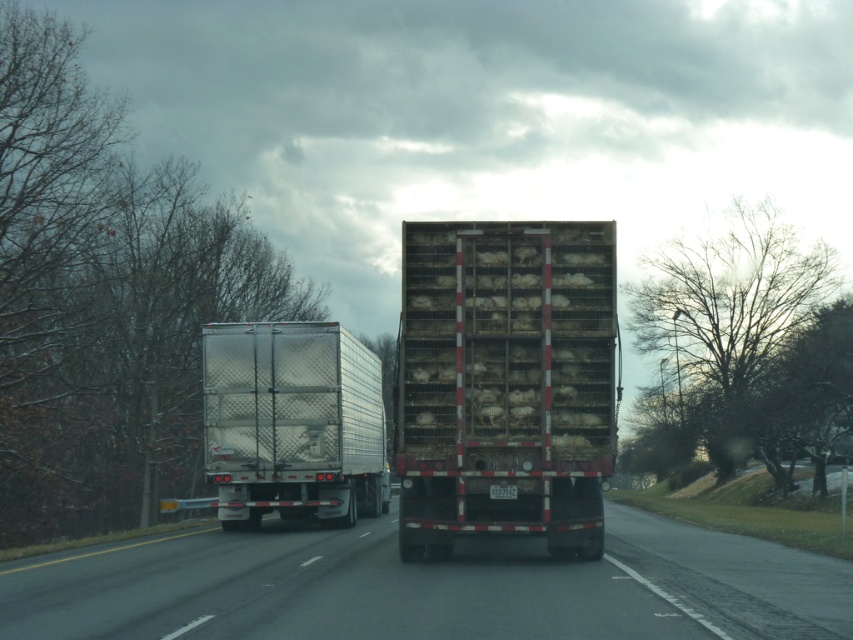
Question: Is the position of black rubber highway at center more distant than that of silver metallic trailer truck at center?

Choices:
 (A) yes
 (B) no

Answer: (B)

Question: Which of the following is the farthest from the observer?

Choices:
 (A) click(231, 403)
 (B) click(428, 241)

Answer: (A)

Question: Is black rubber highway at center to the right of metallic mesh trailer truck at center from the viewer's perspective?

Choices:
 (A) no
 (B) yes

Answer: (A)

Question: Can you confirm if metallic mesh trailer truck at center is wider than silver metallic trailer truck at center?

Choices:
 (A) yes
 (B) no

Answer: (B)

Question: Which point is farther from the camera taking this photo?

Choices:
 (A) (572, 253)
 (B) (6, 598)

Answer: (A)

Question: Based on their relative distances, which object is nearer to the silver metallic trailer truck at center?

Choices:
 (A) black rubber highway at center
 (B) metallic mesh trailer truck at center

Answer: (A)